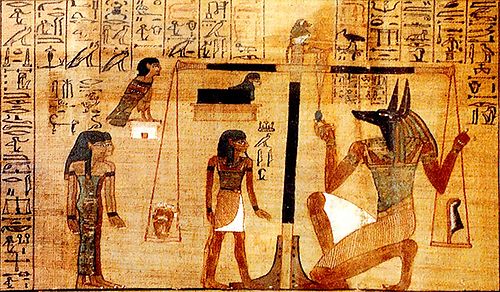
The image size is (500, 292). Find the location of `base of scale`. base of scale is located at coordinates (297, 271), (274, 277).